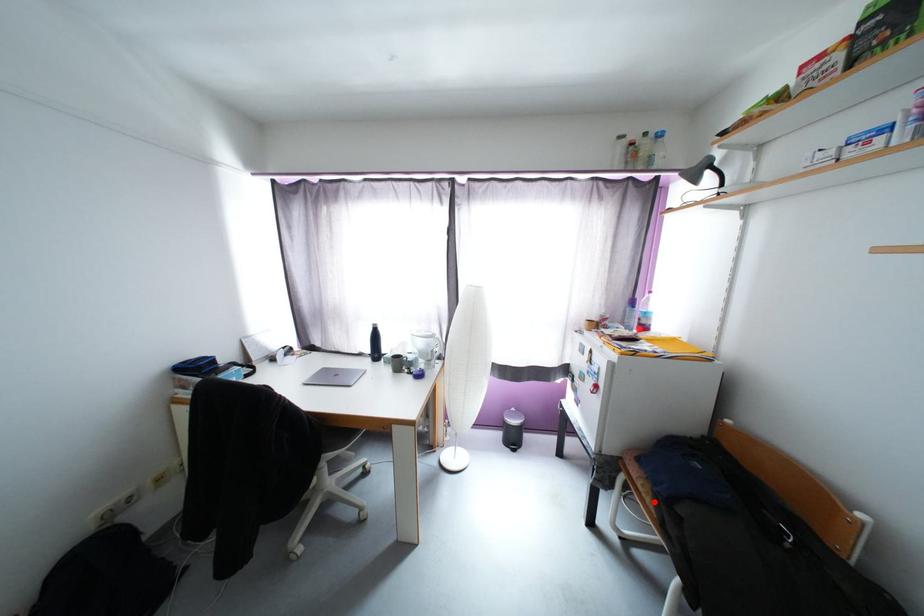
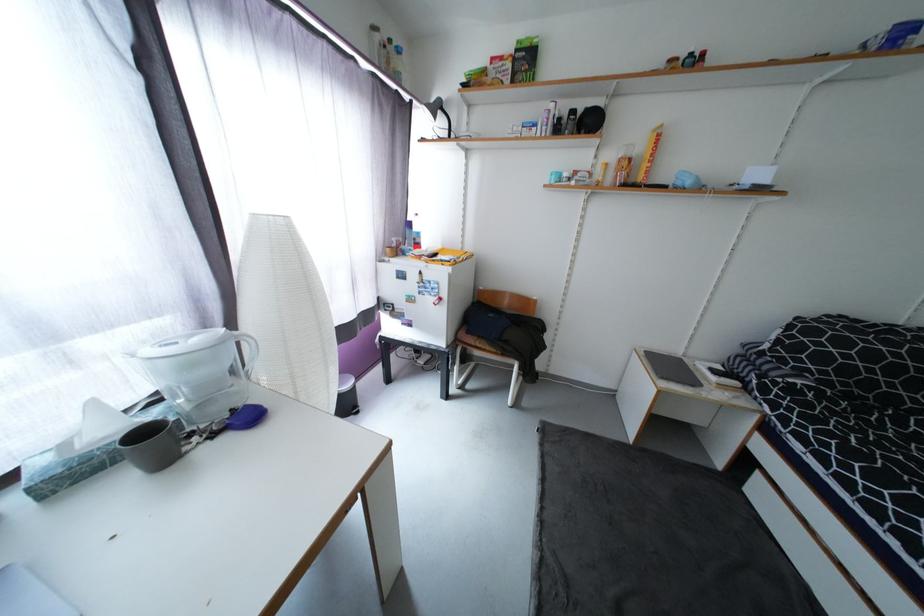
Locate, in the second image, the point that corresponds to the highlighted location in the first image.

(493, 349)